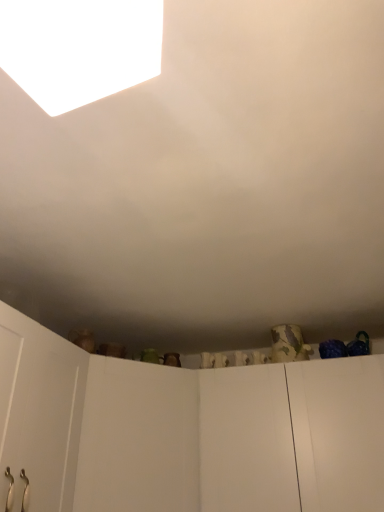
Question: Can you confirm if white matte light at upper left is positioned to the left of white matte door at center?

Choices:
 (A) yes
 (B) no

Answer: (B)

Question: Does white matte light at upper left have a lesser height compared to white matte door at center?

Choices:
 (A) yes
 (B) no

Answer: (A)

Question: Would you say white matte light at upper left contains white matte door at center?

Choices:
 (A) yes
 (B) no

Answer: (B)

Question: From a real-world perspective, is white matte light at upper left positioned over white matte door at center based on gravity?

Choices:
 (A) no
 (B) yes

Answer: (B)

Question: Considering the relative sizes of white matte light at upper left and white matte door at center in the image provided, is white matte light at upper left wider than white matte door at center?

Choices:
 (A) yes
 (B) no

Answer: (B)

Question: Is white matte light at upper left smaller than white matte door at center?

Choices:
 (A) yes
 (B) no

Answer: (A)

Question: Can you confirm if white matte door at center is positioned to the right of white matte light at upper left?

Choices:
 (A) yes
 (B) no

Answer: (B)

Question: Is white matte door at center bigger than white matte light at upper left?

Choices:
 (A) yes
 (B) no

Answer: (A)

Question: Is white matte door at center wider than white matte light at upper left?

Choices:
 (A) yes
 (B) no

Answer: (A)

Question: Is white matte door at center behind white matte light at upper left?

Choices:
 (A) yes
 (B) no

Answer: (A)

Question: Can you confirm if white matte door at center is taller than white matte light at upper left?

Choices:
 (A) yes
 (B) no

Answer: (A)

Question: Can white matte light at upper left be found inside white matte door at center?

Choices:
 (A) yes
 (B) no

Answer: (B)

Question: Choose the correct answer: Is white matte light at upper left inside white matte door at center or outside it?

Choices:
 (A) outside
 (B) inside

Answer: (A)